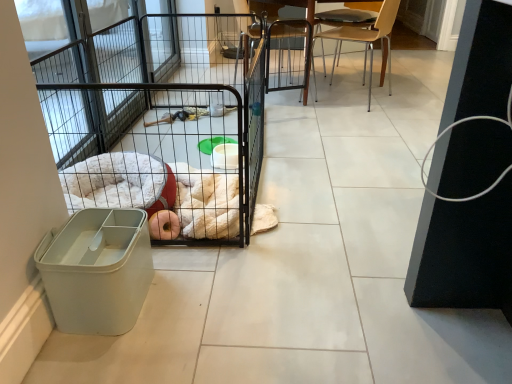
Question: Is wooden chair at center, arranged as the 2th chair when viewed from the right, at the back of light brown wooden chair at upper right, which appears as the second chair when viewed from the left?

Choices:
 (A) yes
 (B) no

Answer: (B)

Question: Could you tell me if light brown wooden chair at upper right, the 1th chair when ordered from right to left, is facing wooden chair at center, arranged as the 2th chair when viewed from the right?

Choices:
 (A) yes
 (B) no

Answer: (A)

Question: Does light brown wooden chair at upper right, the 1th chair when ordered from right to left, come behind wooden chair at center, which appears as the first chair when viewed from the left?

Choices:
 (A) yes
 (B) no

Answer: (B)

Question: From a real-world perspective, is light brown wooden chair at upper right, the 1th chair when ordered from right to left, positioned over wooden chair at center, arranged as the 2th chair when viewed from the right, based on gravity?

Choices:
 (A) no
 (B) yes

Answer: (B)

Question: Considering the relative sizes of light brown wooden chair at upper right, which appears as the second chair when viewed from the left, and wooden chair at center, arranged as the 2th chair when viewed from the right, in the image provided, is light brown wooden chair at upper right, which appears as the second chair when viewed from the left, smaller than wooden chair at center, arranged as the 2th chair when viewed from the right,?

Choices:
 (A) no
 (B) yes

Answer: (B)

Question: Considering the positions of light brown wooden chair at upper right, which appears as the second chair when viewed from the left, and black wire cage at center in the image, is light brown wooden chair at upper right, which appears as the second chair when viewed from the left, bigger or smaller than black wire cage at center?

Choices:
 (A) big
 (B) small

Answer: (B)

Question: From the image's perspective, is light brown wooden chair at upper right, the 1th chair when ordered from right to left, located above or below black wire cage at center?

Choices:
 (A) below
 (B) above

Answer: (B)

Question: From a real-world perspective, is light brown wooden chair at upper right, which appears as the second chair when viewed from the left, physically located above or below black wire cage at center?

Choices:
 (A) below
 (B) above

Answer: (B)

Question: Considering the positions of light brown wooden chair at upper right, the 1th chair when ordered from right to left, and black wire cage at center in the image, is light brown wooden chair at upper right, the 1th chair when ordered from right to left, taller or shorter than black wire cage at center?

Choices:
 (A) tall
 (B) short

Answer: (A)

Question: Does point (290, 44) appear closer or farther from the camera than point (169, 109)?

Choices:
 (A) farther
 (B) closer

Answer: (A)

Question: Looking at the image, does wooden chair at center, arranged as the 2th chair when viewed from the right, seem bigger or smaller compared to black wire cage at center?

Choices:
 (A) big
 (B) small

Answer: (B)

Question: Choose the correct answer: Is wooden chair at center, arranged as the 2th chair when viewed from the right, inside black wire cage at center or outside it?

Choices:
 (A) inside
 (B) outside

Answer: (B)

Question: From a real-world perspective, is wooden chair at center, which appears as the first chair when viewed from the left, positioned above or below black wire cage at center?

Choices:
 (A) above
 (B) below

Answer: (A)

Question: Considering their positions, is light brown wooden chair at upper right, which appears as the second chair when viewed from the left, located in front of or behind wooden chair at center, arranged as the 2th chair when viewed from the right?

Choices:
 (A) behind
 (B) front

Answer: (B)

Question: Is light brown wooden chair at upper right, the 1th chair when ordered from right to left, taller or shorter than wooden chair at center, which appears as the first chair when viewed from the left?

Choices:
 (A) tall
 (B) short

Answer: (B)